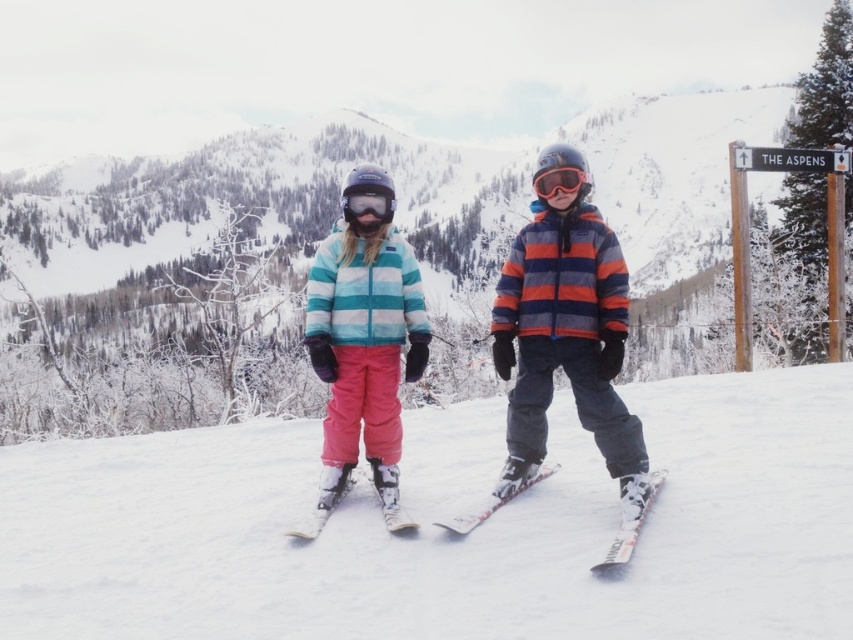
Between matte blue striped jacket at center and white matte ski at center, which one has more height?

With more height is matte blue striped jacket at center.

What do you see at coordinates (566, 342) in the screenshot? This screenshot has width=853, height=640. I see `matte blue striped jacket at center` at bounding box center [566, 342].

This screenshot has height=640, width=853. Identify the location of matte blue striped jacket at center. (566, 342).

Is striped fleece jacket at center above white matte ski at center?

Indeed, striped fleece jacket at center is positioned over white matte ski at center.

Between point (601, 452) and point (314, 509), which one is positioned behind?

The point (601, 452) is more distant.

The image size is (853, 640). Find the location of `striped fleece jacket at center`. striped fleece jacket at center is located at coordinates (566, 340).

Between matte blue striped jacket at center and striped fleece jacket at center, which one has more height?

With more height is matte blue striped jacket at center.

Between matte blue striped jacket at center and striped fleece jacket at center, which one appears on the right side from the viewer's perspective?

Positioned to the right is striped fleece jacket at center.

Between point (621, 253) and point (560, 298), which one is positioned in front?

Positioned in front is point (560, 298).

Locate an element on the screen. Image resolution: width=853 pixels, height=640 pixels. matte blue striped jacket at center is located at coordinates (566, 342).